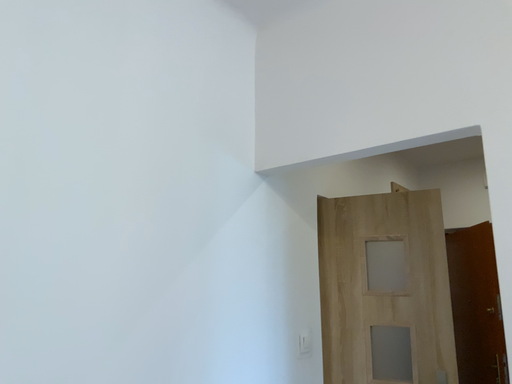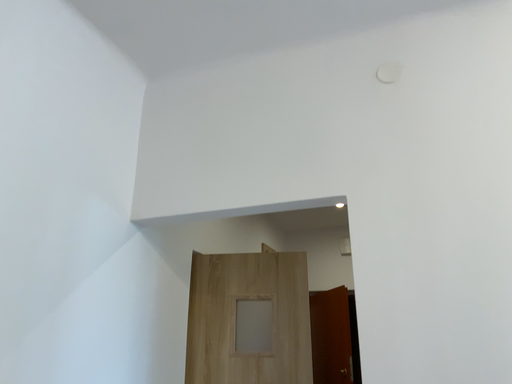
Question: Which way did the camera rotate in the video?

Choices:
 (A) rotated downward
 (B) rotated upward

Answer: (B)